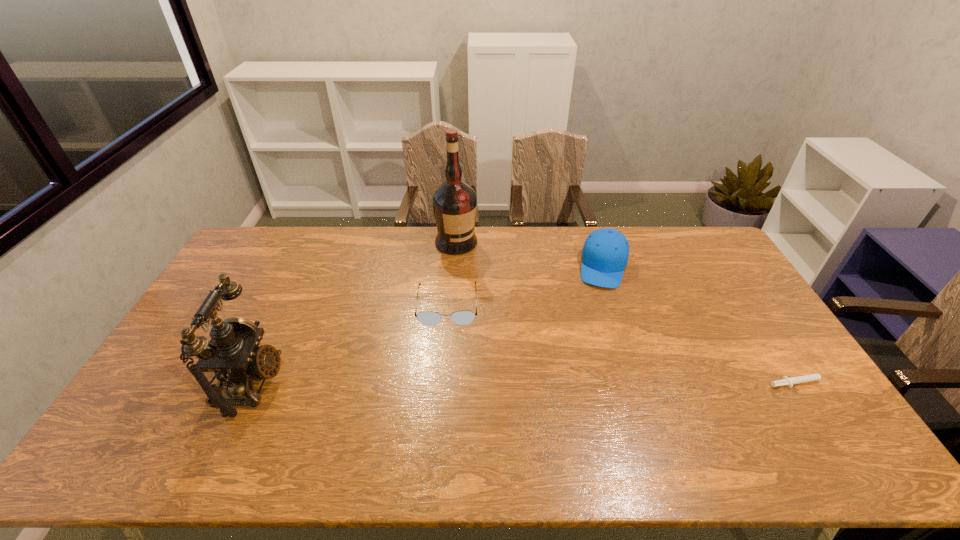
At what (x,y) coordinates should I click in order to perform the action: click on the leftmost object. Please return your answer as a coordinate pair (x, y). Image resolution: width=960 pixels, height=540 pixels. Looking at the image, I should click on tap(232, 355).

Find the location of a particular element. The image size is (960, 540). the second tallest object is located at coordinates tap(232, 355).

Where is `the shortest object`? Image resolution: width=960 pixels, height=540 pixels. the shortest object is located at coordinates point(789,382).

This screenshot has height=540, width=960. Find the location of `syringe`. syringe is located at coordinates (789, 382).

Identify the location of the tallest object. (454, 202).

The width and height of the screenshot is (960, 540). What are the coordinates of `the second object from right to left` in the screenshot? It's located at (605, 253).

At what (x,y) coordinates should I click in order to perform the action: click on cap. Please return your answer as a coordinate pair (x, y). This screenshot has height=540, width=960. Looking at the image, I should click on (605, 253).

Where is `the second shortest object`? This screenshot has height=540, width=960. the second shortest object is located at coordinates (429, 318).

Locate an element on the screen. The image size is (960, 540). vacant space located on the rotary dial of the leftmost object is located at coordinates (325, 383).

Locate an element on the screen. free space located 0.070m on the back of the syringe is located at coordinates (785, 356).